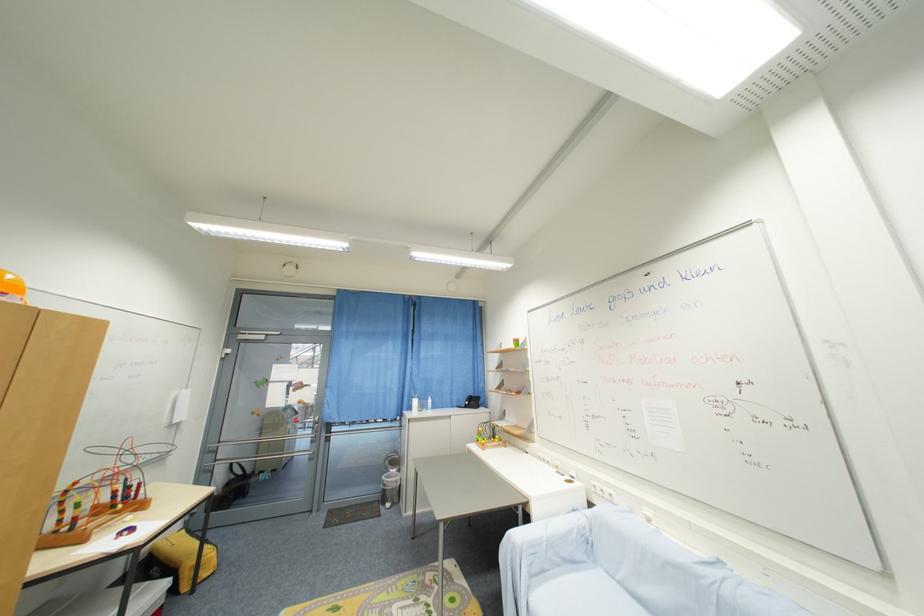
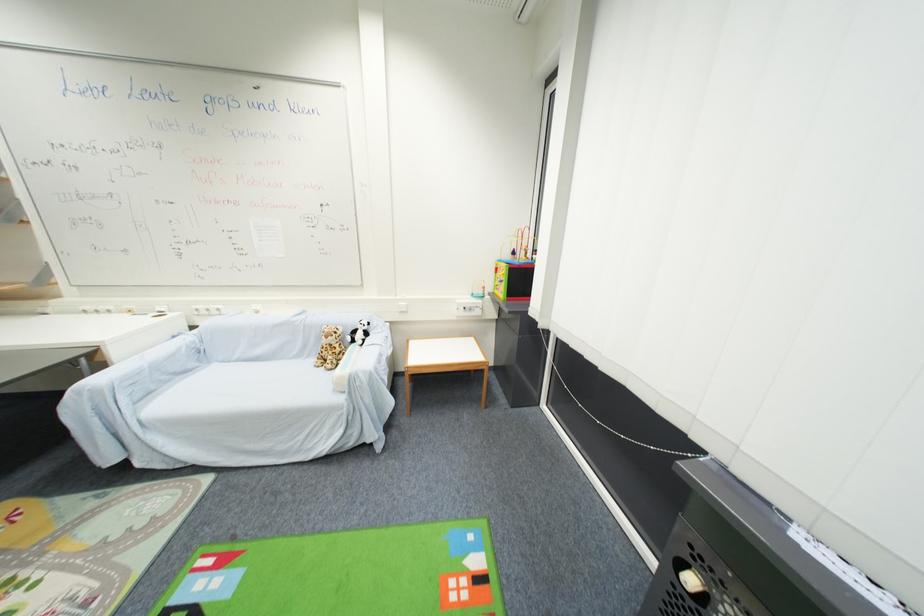
The first image is from the beginning of the video and the second image is from the end. How did the camera likely rotate when shooting the video?

The camera's rotation is toward right-down.